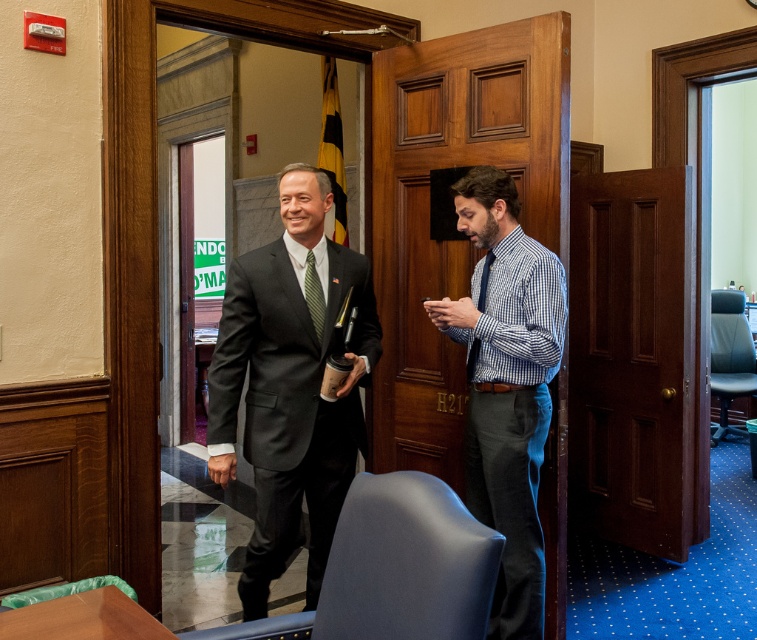
Looking at this image, you are an event planner organizing a photo shoot in this office. You need to place a large backdrop behind the two central figures, the matte black suit at center and the blue checkered shirt at center. Based on their sizes, which figure should be positioned closer to the backdrop to ensure both are fully visible in the photo?

The matte black suit at center is bigger than the blue checkered shirt at center, so positioning the matte black suit at center closer to the backdrop will ensure both figures are fully visible in the photo.

You are an event planner setting up a photo shoot in this office. You need to place a camera 12 inches away from the matte black suit at center to capture the details. Will the camera also be within 12 inches of the green textured tie at center?

The matte black suit at center and green textured tie at center are 11.84 inches apart from each other. Since the camera is placed 12 inches away from the matte black suit at center, the distance between the camera and the green textured tie at center would be approximately 12 inches minus 11.84 inches, which is 0.16 inches. Therefore, the camera will be within 12 inches of the green textured tie at center.

You are an event planner arranging seating for a meeting in this office. You need to place a name tag on the table in front of each attendee. Given that the matte black suit at center and the blue checkered shirt at center are both seated at the table, which attendee should receive the name tag closer to the top edge of the table?

The matte black suit at center should have their name tag placed closer to the top edge of the table because the matte black suit at center is located above the blue checkered shirt at center.